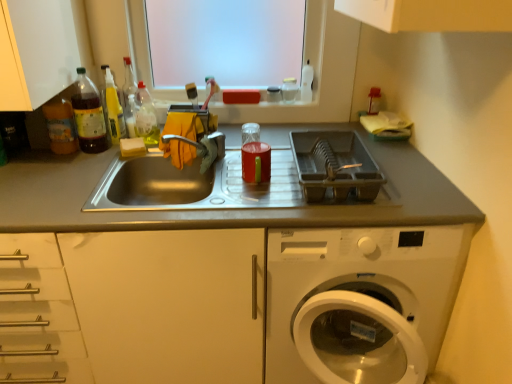
This screenshot has height=384, width=512. What are the coordinates of `blank area to the left of white sponge at sink left` in the screenshot? It's located at pos(83,158).